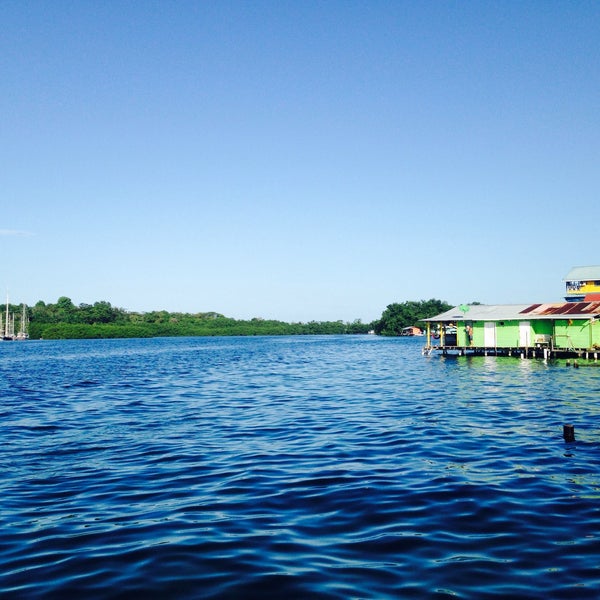
This screenshot has width=600, height=600. Identify the location of windows. (572, 282), (585, 283), (596, 283).